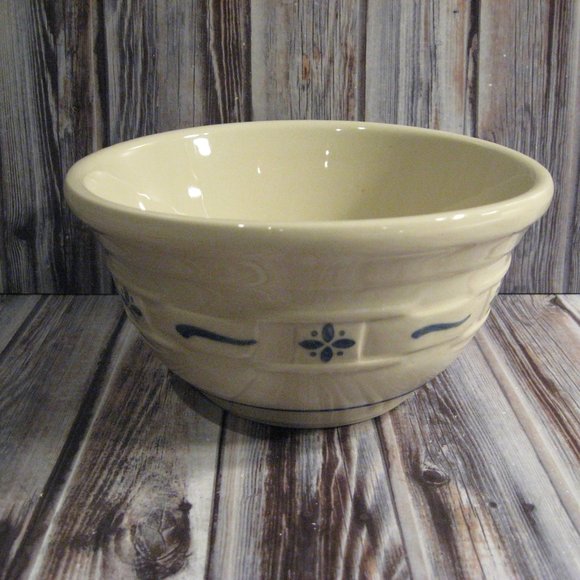
Locate an element on the screen. The height and width of the screenshot is (580, 580). cream colored bowl is located at coordinates (290, 259).